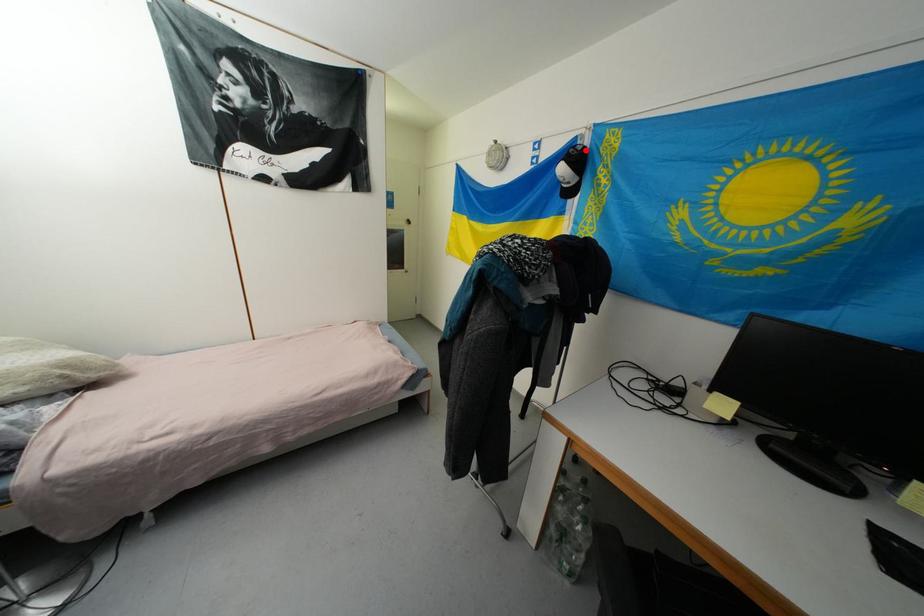
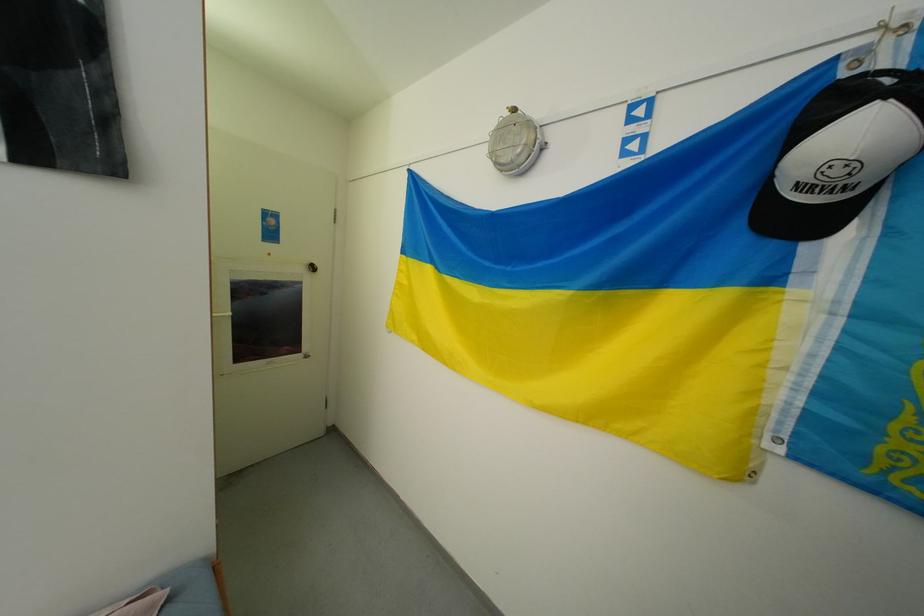
Question: I am providing you with two images of the same scene from different viewpoints. In image1, a red point is highlighted. Considering the same 3D point in image2, which of the following is correct?

Choices:
 (A) It is closer
 (B) It is farther

Answer: (B)